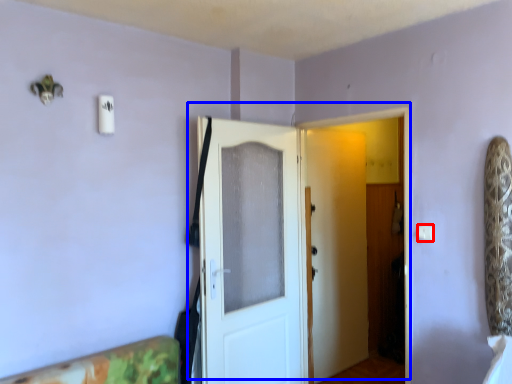
Question: Among these objects, which one is farthest to the camera, light switch (highlighted by a red box) or door (highlighted by a blue box)?

Choices:
 (A) light switch
 (B) door

Answer: (B)